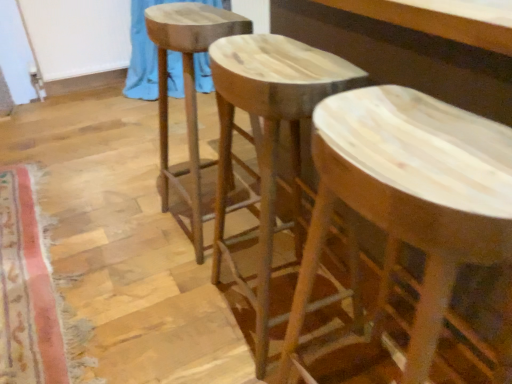
I want to click on vacant region to the left of natural wood stool at center, the 2th stool positioned from the right, so click(x=170, y=313).